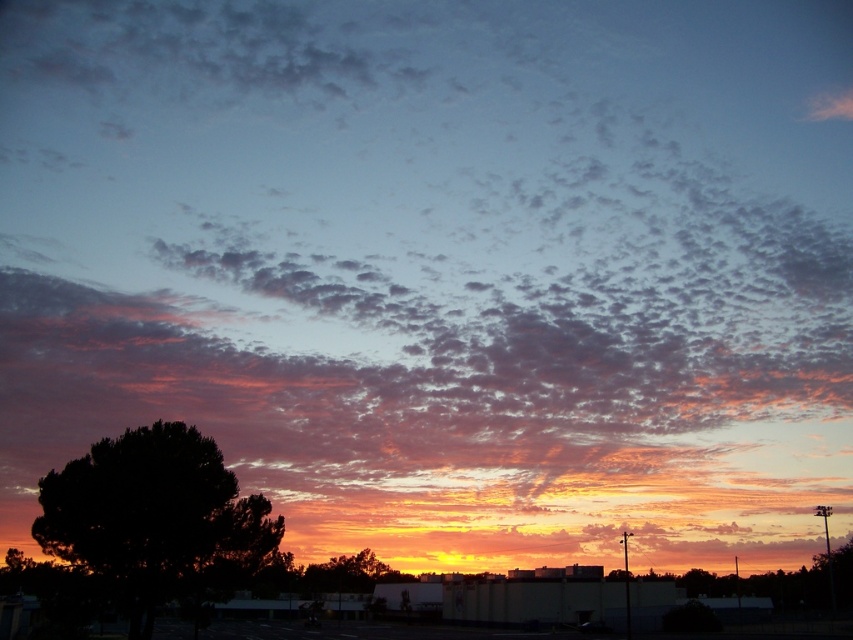
Question: Which point appears farthest from the camera in this image?

Choices:
 (A) (163, 488)
 (B) (311, 577)

Answer: (B)

Question: Is dark green leafy tree at lower left closer to camera compared to green leafy tree at center?

Choices:
 (A) no
 (B) yes

Answer: (B)

Question: Does dark green leafy tree at lower left appear on the right side of green leafy tree at center?

Choices:
 (A) no
 (B) yes

Answer: (B)

Question: Among these points, which one is nearest to the camera?

Choices:
 (A) (55, 531)
 (B) (321, 577)

Answer: (A)

Question: Does dark green leafy tree at lower left appear under green leafy tree at center?

Choices:
 (A) yes
 (B) no

Answer: (B)